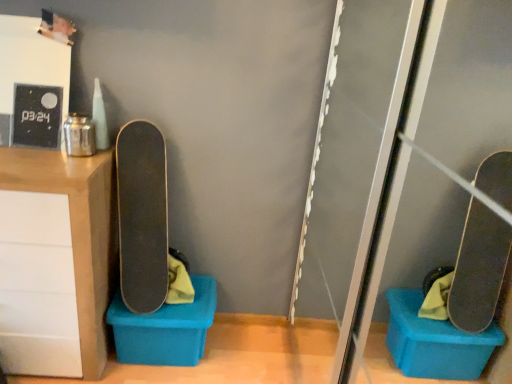
The image size is (512, 384). What do you see at coordinates (77, 231) in the screenshot? I see `matte wood cabinet at left` at bounding box center [77, 231].

Measure the distance between point (147, 150) and camera.

The depth of point (147, 150) is 5.47 feet.

Measure the distance between smooth black skateboard at center and camera.

smooth black skateboard at center is 5.35 feet from camera.

The height and width of the screenshot is (384, 512). What are the coordinates of `blue plastic storage box at lower left` in the screenshot? It's located at (165, 328).

Measure the distance between blue plastic storage box at lower left and camera.

A distance of 5.60 feet exists between blue plastic storage box at lower left and camera.

Locate an element on the screen. Image resolution: width=512 pixels, height=384 pixels. matte wood cabinet at left is located at coordinates (77, 231).

In the image, is smooth black skateboard at center positioned in front of or behind transparent plastic screen door at right?

In the image, smooth black skateboard at center appears behind transparent plastic screen door at right.

Looking at their sizes, would you say smooth black skateboard at center is wider or thinner than transparent plastic screen door at right?

In the image, smooth black skateboard at center appears to be more narrow than transparent plastic screen door at right.

Is smooth black skateboard at center positioned with its back to transparent plastic screen door at right?

No, transparent plastic screen door at right is not at the back of smooth black skateboard at center.

Who is bigger, smooth black skateboard at center or blue plastic storage box at lower left?

With larger size is smooth black skateboard at center.

Are smooth black skateboard at center and blue plastic storage box at lower left beside each other?

No, smooth black skateboard at center is not touching blue plastic storage box at lower left.

Which is in front, point (164, 209) or point (185, 353)?

Positioned in front is point (164, 209).

Considering the relative positions of smooth black skateboard at center and blue plastic storage box at lower left in the image provided, is smooth black skateboard at center to the left or to the right of blue plastic storage box at lower left?

In the image, smooth black skateboard at center appears on the left side of blue plastic storage box at lower left.

Is blue plastic storage box at lower left facing towards smooth black skateboard at center?

No, blue plastic storage box at lower left is not turned towards smooth black skateboard at center.

Considering the sizes of objects blue plastic storage box at lower left and smooth black skateboard at center in the image provided, who is bigger, blue plastic storage box at lower left or smooth black skateboard at center?

smooth black skateboard at center is bigger.

Is blue plastic storage box at lower left spatially inside smooth black skateboard at center, or outside of it?

blue plastic storage box at lower left lies outside smooth black skateboard at center.

Which of these two, matte wood cabinet at left or blue plastic storage box at lower left, is bigger?

matte wood cabinet at left is bigger.

Considering the relative positions of matte wood cabinet at left and blue plastic storage box at lower left in the image provided, is matte wood cabinet at left to the left or to the right of blue plastic storage box at lower left?

Based on their positions, matte wood cabinet at left is located to the left of blue plastic storage box at lower left.

Does matte wood cabinet at left have a lesser width compared to blue plastic storage box at lower left?

In fact, matte wood cabinet at left might be wider than blue plastic storage box at lower left.

Is transparent plastic screen door at right taller than blue plastic storage box at lower left?

Correct, transparent plastic screen door at right is much taller as blue plastic storage box at lower left.

From a real-world perspective, is transparent plastic screen door at right positioned above or below blue plastic storage box at lower left?

Clearly, from a real-world perspective, transparent plastic screen door at right is above blue plastic storage box at lower left.

From the image's perspective, is transparent plastic screen door at right located beneath blue plastic storage box at lower left?

No, from the image's perspective, transparent plastic screen door at right is not beneath blue plastic storage box at lower left.

Is blue plastic storage box at lower left a part of transparent plastic screen door at right?

That's incorrect, blue plastic storage box at lower left is not inside transparent plastic screen door at right.

Which object is closer to the camera, matte wood cabinet at left or transparent plastic screen door at right?

transparent plastic screen door at right is closer to the camera.

Is matte wood cabinet at left facing away from transparent plastic screen door at right?

No, matte wood cabinet at left is not facing away from transparent plastic screen door at right.

Which object is wider, matte wood cabinet at left or transparent plastic screen door at right?

transparent plastic screen door at right is wider.

Does blue plastic storage box at lower left have a larger size compared to transparent plastic screen door at right?

Incorrect, blue plastic storage box at lower left is not larger than transparent plastic screen door at right.

Is blue plastic storage box at lower left facing towards transparent plastic screen door at right?

No, blue plastic storage box at lower left does not turn towards transparent plastic screen door at right.

From a real-world perspective, is blue plastic storage box at lower left below transparent plastic screen door at right?

Yes.

Which point is more distant from viewer, (195,341) or (315,305)?

Positioned behind is point (315,305).

Where is `screen door in front of the smooth black skateboard at center`? Image resolution: width=512 pixels, height=384 pixels. screen door in front of the smooth black skateboard at center is located at coordinates [362, 159].

Find the location of a particular element. The height and width of the screenshot is (384, 512). skateboard above the blue plastic storage box at lower left (from the image's perspective) is located at coordinates (142, 216).

Estimate the real-world distances between objects in this image. Which object is further from matte wood cabinet at left, transparent plastic screen door at right or blue plastic storage box at lower left?

transparent plastic screen door at right is positioned further to the anchor matte wood cabinet at left.

From the picture: Looking at the image, which one is located closer to matte wood cabinet at left, smooth black skateboard at center or transparent plastic screen door at right?

Based on the image, smooth black skateboard at center appears to be nearer to matte wood cabinet at left.

Based on their spatial positions, is transparent plastic screen door at right or smooth black skateboard at center closer to matte wood cabinet at left?

smooth black skateboard at center lies closer to matte wood cabinet at left than the other object.

Looking at the image, which one is located closer to smooth black skateboard at center, blue plastic storage box at lower left or transparent plastic screen door at right?

Based on the image, blue plastic storage box at lower left appears to be nearer to smooth black skateboard at center.

Based on their spatial positions, is smooth black skateboard at center or matte wood cabinet at left closer to blue plastic storage box at lower left?

smooth black skateboard at center is closer to blue plastic storage box at lower left.

Based on their spatial positions, is matte wood cabinet at left or transparent plastic screen door at right further from blue plastic storage box at lower left?

transparent plastic screen door at right is further to blue plastic storage box at lower left.

Considering their positions, is blue plastic storage box at lower left positioned closer to smooth black skateboard at center than matte wood cabinet at left?

matte wood cabinet at left is closer to smooth black skateboard at center.

Considering their positions, is transparent plastic screen door at right positioned further to blue plastic storage box at lower left than smooth black skateboard at center?

The object further to blue plastic storage box at lower left is transparent plastic screen door at right.

This screenshot has width=512, height=384. Identify the location of skateboard between transparent plastic screen door at right and blue plastic storage box at lower left in the front-back direction. (142, 216).

Locate an element on the screen. This screenshot has width=512, height=384. skateboard located between matte wood cabinet at left and blue plastic storage box at lower left in the left-right direction is located at coordinates (142, 216).

Where is `skateboard between matte wood cabinet at left and transparent plastic screen door at right in the horizontal direction`? skateboard between matte wood cabinet at left and transparent plastic screen door at right in the horizontal direction is located at coordinates (142, 216).

At what (x,y) coordinates should I click in order to perform the action: click on storage box between matte wood cabinet at left and transparent plastic screen door at right from left to right. Please return your answer as a coordinate pair (x, y). Looking at the image, I should click on tap(165, 328).